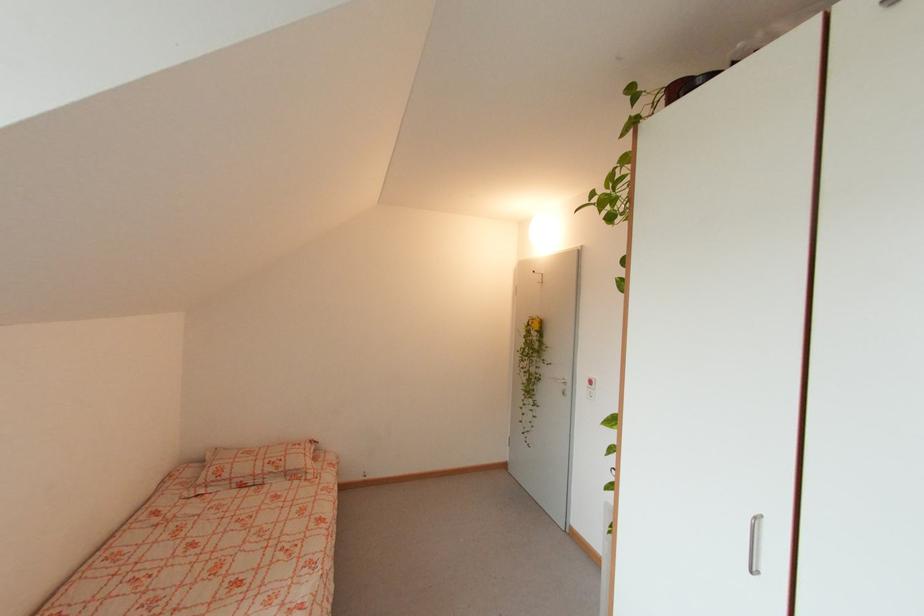
Where is `red light switch`? Image resolution: width=924 pixels, height=616 pixels. red light switch is located at coordinates (590, 382).